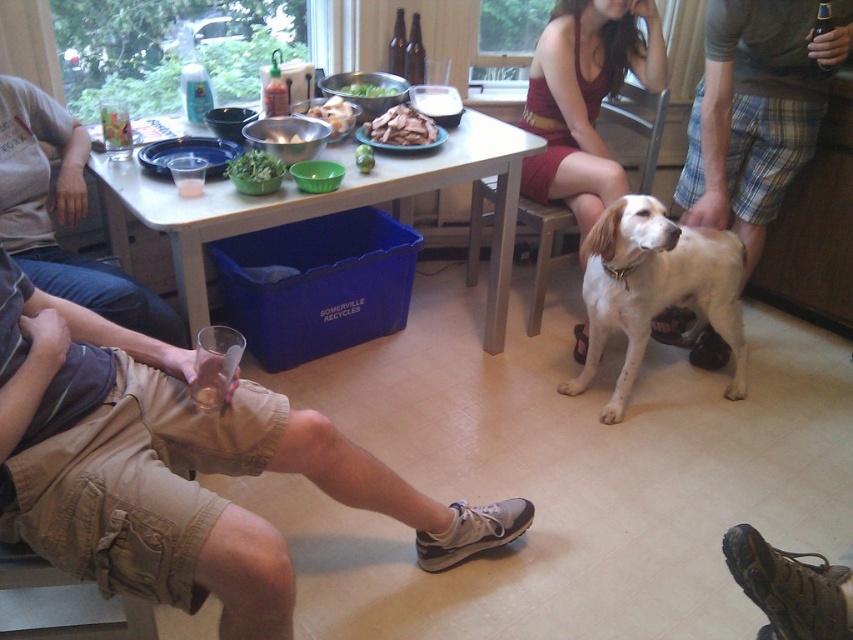
You are at a party and want to take a photo of the maroon fabric dress at center and the white fur dog at center. Since the dress is covering part of the dog, will you need to adjust the camera angle to fully capture both subjects?

The maroon fabric dress at center is positioned over white fur dog at center, so adjusting the camera angle might be necessary to ensure both are fully visible without obstruction.

You are a guest at the gathering and want to borrow a pair of shorts to change into. Both the tan cotton shorts at lower left and the light brown cotton shorts at lower left are available. Which pair has a larger size?

The tan cotton shorts at lower left has a larger size compared to the light brown cotton shorts at lower left.

You are a food server arranging appetizers on a table. You have two types of mushrooms, the brown matte mushrooms at center and white matte mushrooms at center. If you want to place a decorative plate between them, what is the minimum width the plate should be to fit between them?

The brown matte mushrooms at center and white matte mushrooms at center are 5.48 inches apart, so the decorative plate should be at least 5.48 inches wide to fit between them.